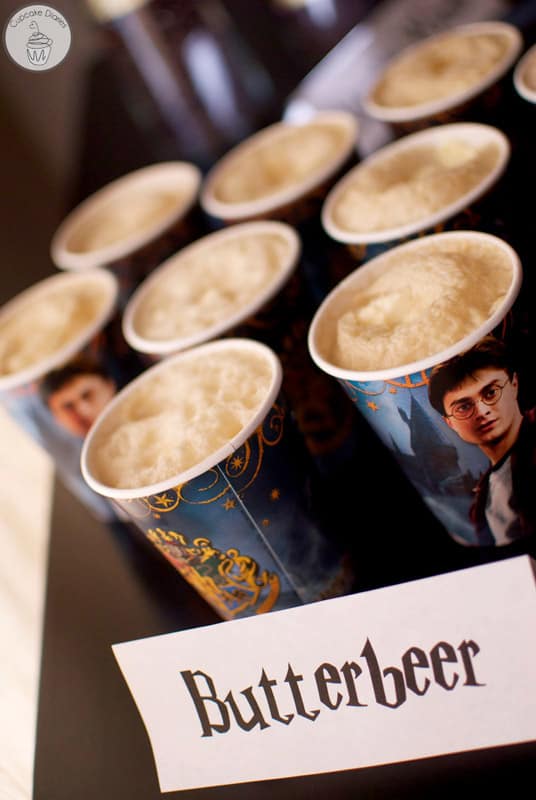
At what (x,y) coordinates should I click in order to perform the action: click on scrollwork. Please return your answer as a coordinate pair (x, y). The height and width of the screenshot is (800, 536). Looking at the image, I should click on (237, 456), (404, 385), (34, 386), (445, 222), (249, 322).